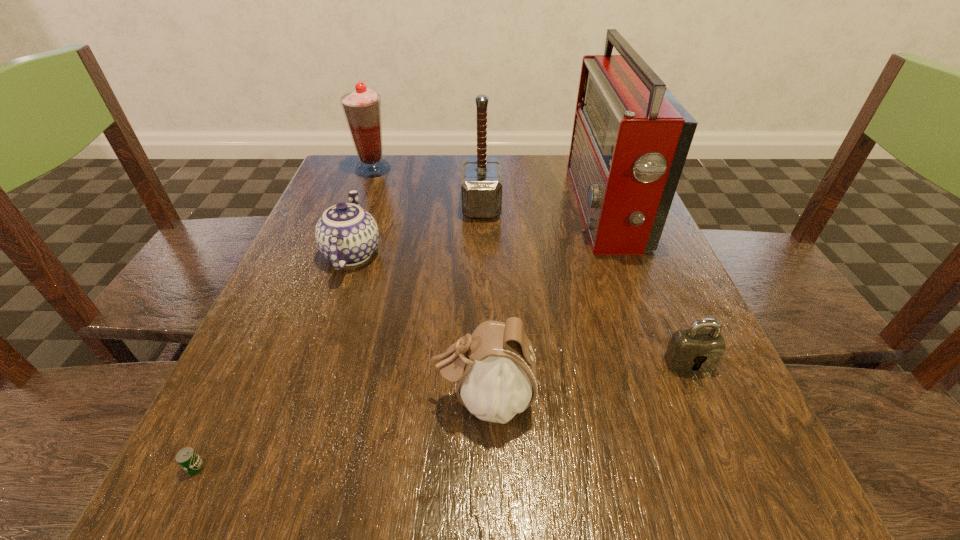
Locate an element on the screen. vacant area that lies between the hammer and the smoothie is located at coordinates click(x=427, y=187).

You are a GUI agent. You are given a task and a screenshot of the screen. Output one action in this format:
    pyautogui.click(x=<x>, y=<y>)
    Task: Click on the vacant area that lies between the radio receiver and the third shortest object
    
    Given the screenshot: What is the action you would take?
    pyautogui.click(x=478, y=231)

Where is `vacant space in between the fourth shortest object and the chinaware`? vacant space in between the fourth shortest object and the chinaware is located at coordinates (419, 327).

Find the location of a particular element. The width and height of the screenshot is (960, 540). free space between the hammer and the pouch is located at coordinates pos(483,302).

Find the location of `vacant space that is in between the smoothie and the shortest object`. vacant space that is in between the smoothie and the shortest object is located at coordinates (284, 318).

In order to click on free area in between the fourth shortest object and the chinaware in this screenshot , I will do `click(419, 327)`.

At what (x,y) coordinates should I click in order to perform the action: click on empty space that is in between the chinaware and the sixth tallest object. Please return your answer as a coordinate pair (x, y). Looking at the image, I should click on (520, 308).

Image resolution: width=960 pixels, height=540 pixels. I want to click on vacant area that lies between the hammer and the pouch, so click(483, 302).

The height and width of the screenshot is (540, 960). What are the coordinates of `free space between the second shortest object and the chinaware` in the screenshot? It's located at (520, 308).

Locate which object ranks third in proximity to the third shortest object. Please provide its 2D coordinates. Your answer should be formatted as a tuple, i.e. [(x, y)], where the tuple contains the x and y coordinates of a point satisfying the conditions above.

[(494, 369)]